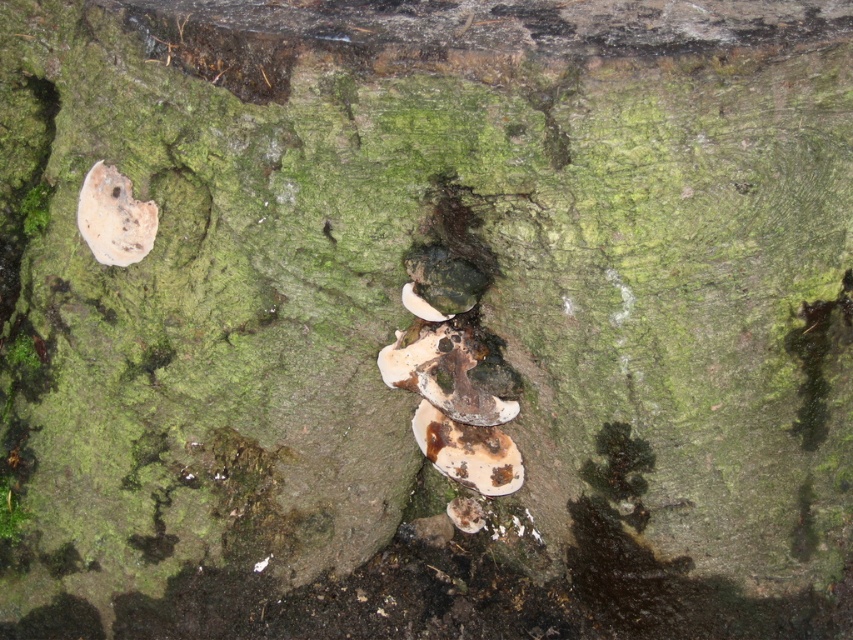
You are a mycologist examining the tree trunk. You notice the brown textured mushroom at center and the white matte mushroom at upper left. Which mushroom is positioned more to the right side of the tree trunk?

The brown textured mushroom at center is positioned more to the right side of the tree trunk compared to the white matte mushroom at upper left.

You are a mycologist examining the tree trunk. You need to determine which mushroom is taller between the brown textured mushroom at center and the white matte mushroom at upper left. Which one is taller?

The brown textured mushroom at center is taller than the white matte mushroom at upper left.

You are a biologist studying the tree trunk. You have two points marked on the image at coordinates point (x=461, y=464) and point (x=115, y=228). Which point is closer to the front of the tree trunk?

Point (x=115, y=228) is closer to the front of the tree trunk because the description states that point (x=461, y=464) is behind point (x=115, y=228).